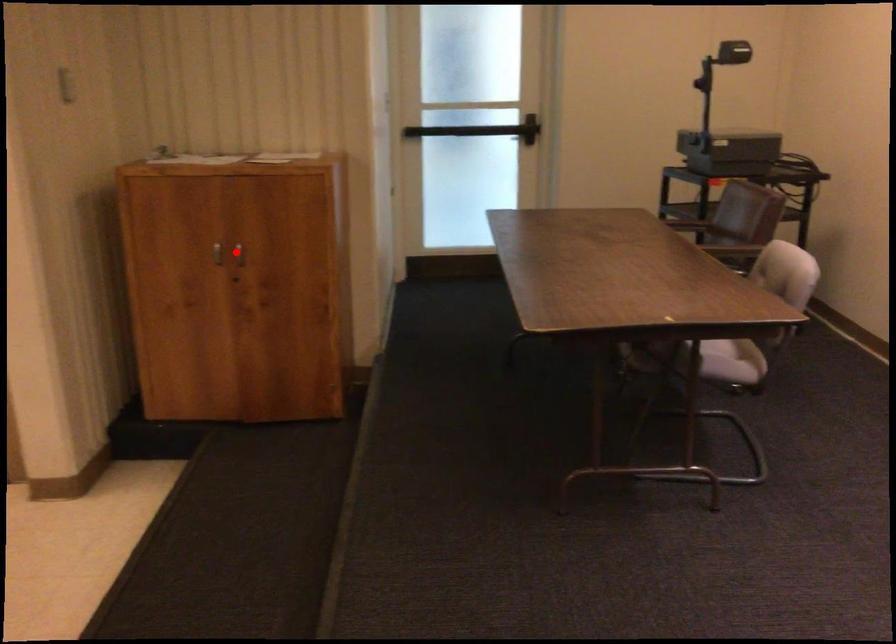
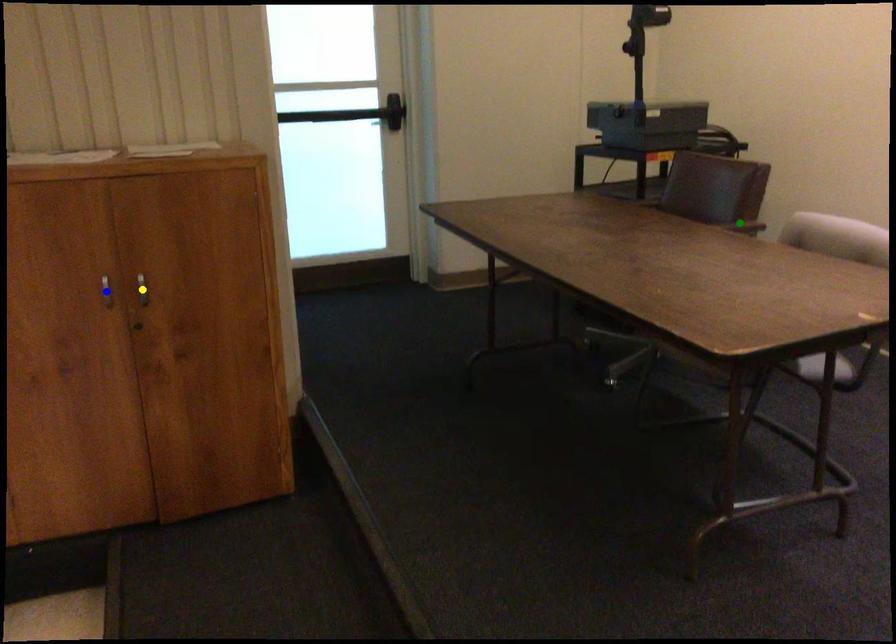
Question: I am providing you with two images of the same scene from different viewpoints. A red point is marked on the first image. You are given multiple points on the second image. Which mark in image 2 goes with the point in image 1?

Choices:
 (A) green point
 (B) yellow point
 (C) blue point

Answer: (B)